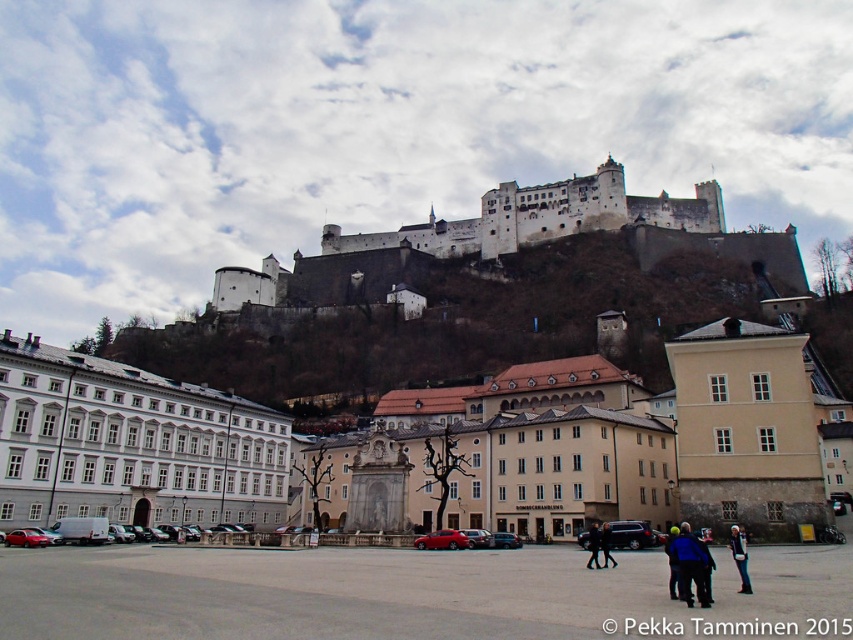
Does white stone castle at upper center have a lesser width compared to black leather jacket at lower center?

Incorrect, white stone castle at upper center's width is not less than black leather jacket at lower center's.

Can you confirm if white stone castle at upper center is positioned to the right of black leather jacket at lower center?

In fact, white stone castle at upper center is to the left of black leather jacket at lower center.

What do you see at coordinates (540, 218) in the screenshot? I see `white stone castle at upper center` at bounding box center [540, 218].

Find the location of a particular element. This screenshot has height=640, width=853. white stone castle at upper center is located at coordinates (540, 218).

Describe the element at coordinates (689, 564) in the screenshot. This screenshot has width=853, height=640. I see `dark blue jacket at center` at that location.

Between dark blue jacket at center and black leather jacket at lower center, which one has more height?

With more height is dark blue jacket at center.

Is point (705, 593) in front of point (593, 560)?

Yes, point (705, 593) is closer to viewer.

The width and height of the screenshot is (853, 640). In order to click on dark blue jacket at center in this screenshot , I will do `click(689, 564)`.

Image resolution: width=853 pixels, height=640 pixels. Describe the element at coordinates (540, 218) in the screenshot. I see `white stone castle at upper center` at that location.

Between white stone castle at upper center and blue fabric jacket at lower right, which one is positioned higher?

white stone castle at upper center

Describe the element at coordinates (540, 218) in the screenshot. The width and height of the screenshot is (853, 640). I see `white stone castle at upper center` at that location.

The height and width of the screenshot is (640, 853). Find the location of `white stone castle at upper center`. white stone castle at upper center is located at coordinates (540, 218).